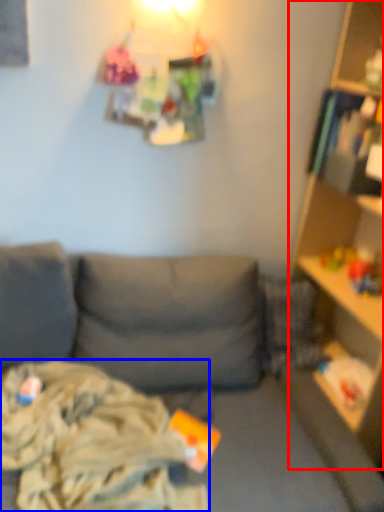
Question: Among these objects, which one is farthest to the camera, shelf (highlighted by a red box) or clothing (highlighted by a blue box)?

Choices:
 (A) shelf
 (B) clothing

Answer: (B)